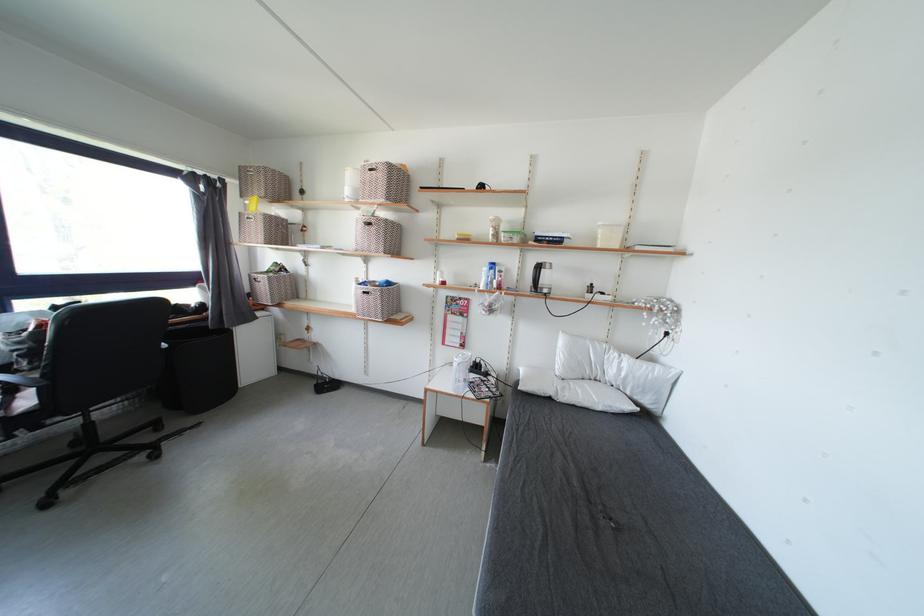
The location [198,369] corresponds to which object?

It corresponds to the black trash bin in the image.